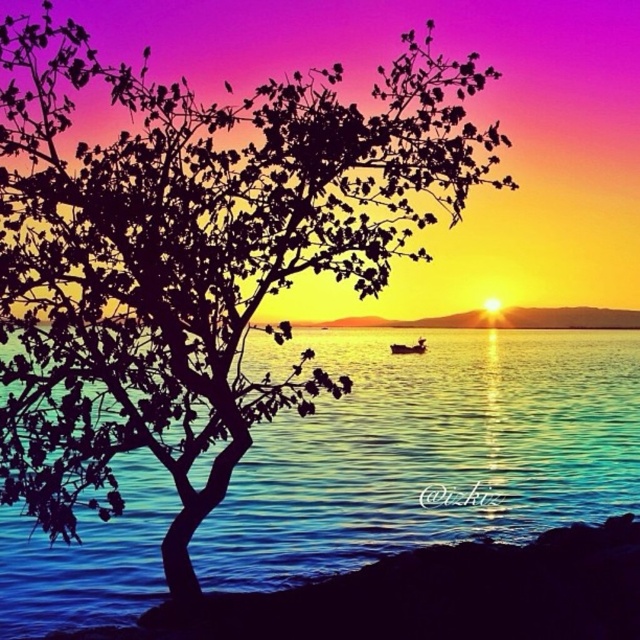
You are standing on the rocky outcrop where the tree is growing. You see the blue liquid water at center and the wooden boat at center. Which object is closer to your feet?

The blue liquid water at center is closer to your feet since it is positioned below the wooden boat at center.

You are standing on the rocky outcrop where the tree is growing. You see the blue liquid water at center and the wooden boat at center. Which one is wider from your perspective?

The blue liquid water at center is wider than the wooden boat at center according to the description.

You are standing on the shore looking at the blue liquid water at center and the wooden boat at center. Which object is closer to your left side?

The blue liquid water at center is closer to your left side because it is positioned to the left of the wooden boat at center.